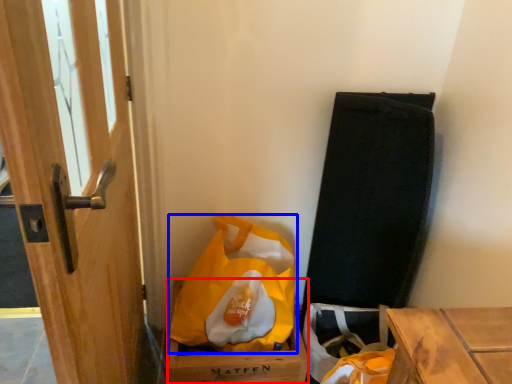
Question: Among these objects, which one is farthest to the camera, cardboard box (highlighted by a red box) or plastic bag (highlighted by a blue box)?

Choices:
 (A) cardboard box
 (B) plastic bag

Answer: (A)